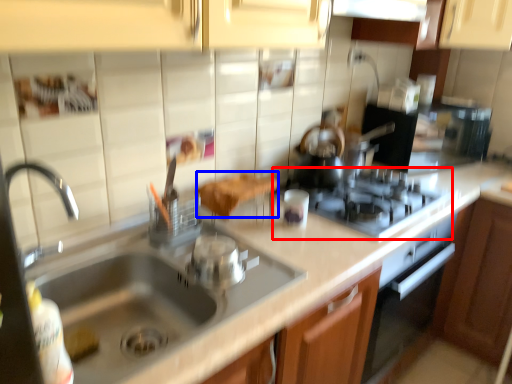
Question: Which object is closer to the camera taking this photo, gas stove (highlighted by a red box) or food (highlighted by a blue box)?

Choices:
 (A) gas stove
 (B) food

Answer: (B)